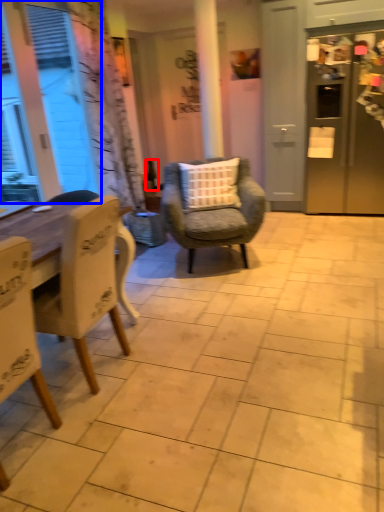
Question: Which point is closer to the camera, bottle (highlighted by a red box) or window screen (highlighted by a blue box)?

Choices:
 (A) bottle
 (B) window screen

Answer: (B)